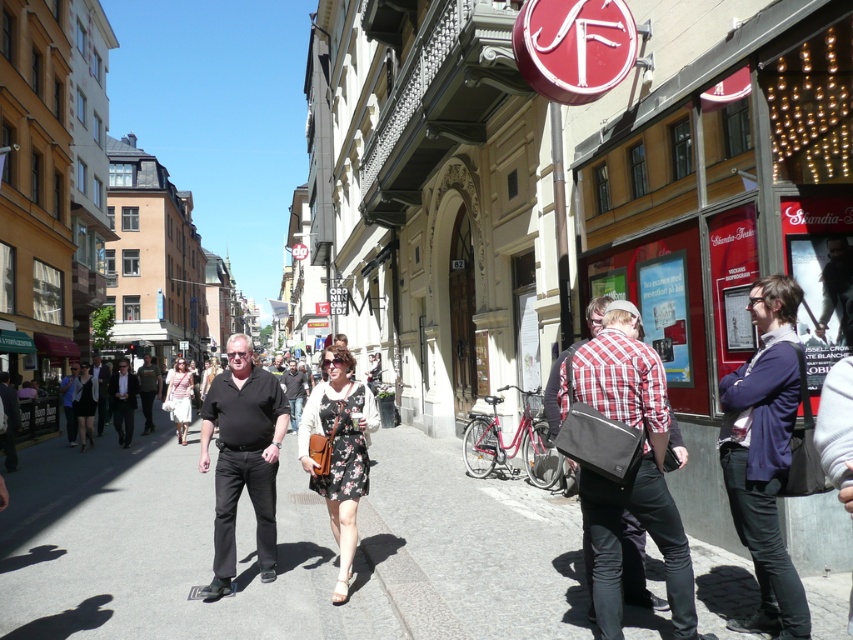
You are standing on the sidewalk and want to step onto the gray asphalt at center. Is the dark gray cotton shirt at center in your way?

The gray asphalt at center is above the dark gray cotton shirt at center, meaning the shirt is below it. Since the shirt is part of a person, stepping onto the asphalt would require moving past the person wearing the shirt.

You are a photographer standing on the sidewalk in this urban scene. You notice two people wearing a red checkered shirt at center and a dark gray shirt at center. Which person would you need to look up at to photograph their face?

You would need to look up at the person wearing the red checkered shirt at center because it is located above the dark gray shirt at center, indicating they are taller or positioned higher.